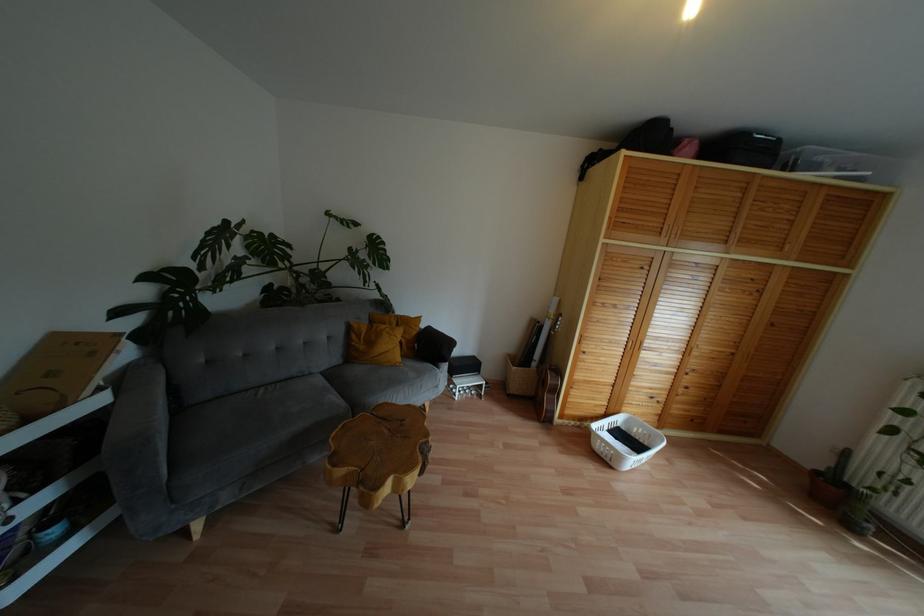
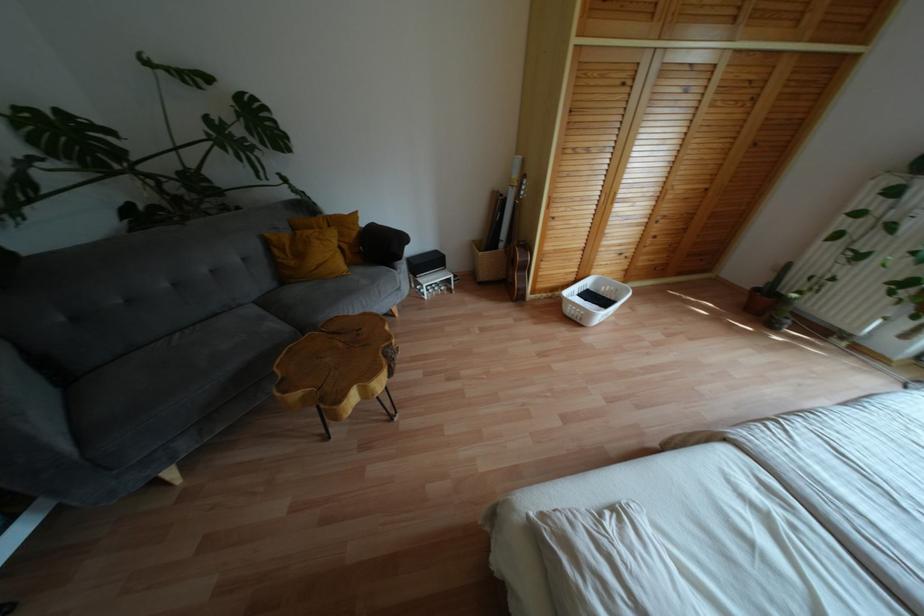
Locate, in the second image, the point that corresponds to (x=418, y=318) in the first image.

(354, 214)